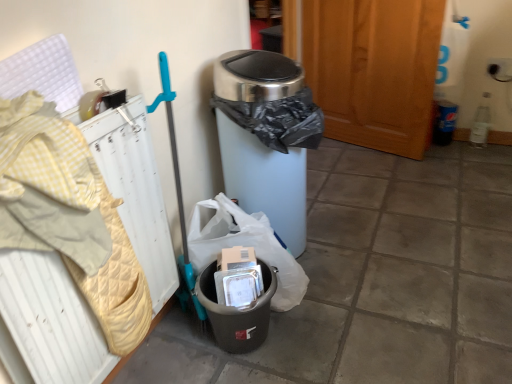
Question: From the image's perspective, does stainless steel trash can at center, the first waste container in the top-to-bottom sequence, appear higher than wooden screen door at center?

Choices:
 (A) yes
 (B) no

Answer: (B)

Question: Are stainless steel trash can at center, which is counted as the 2th waste container, starting from the bottom, and wooden screen door at center beside each other?

Choices:
 (A) yes
 (B) no

Answer: (B)

Question: From the image's perspective, is stainless steel trash can at center, the first waste container in the top-to-bottom sequence, beneath wooden screen door at center?

Choices:
 (A) yes
 (B) no

Answer: (A)

Question: Is stainless steel trash can at center, the first waste container in the top-to-bottom sequence, at the left side of wooden screen door at center?

Choices:
 (A) no
 (B) yes

Answer: (B)

Question: Can you confirm if stainless steel trash can at center, which is counted as the 2th waste container, starting from the bottom, is taller than wooden screen door at center?

Choices:
 (A) no
 (B) yes

Answer: (A)

Question: Is wooden screen door at center spatially inside matte gray trash can at lower left, which is counted as the second waste container, starting from the top, or outside of it?

Choices:
 (A) inside
 (B) outside

Answer: (B)

Question: Is wooden screen door at center wider or thinner than matte gray trash can at lower left, which is counted as the second waste container, starting from the top?

Choices:
 (A) wide
 (B) thin

Answer: (B)

Question: In the image, is wooden screen door at center positioned in front of or behind matte gray trash can at lower left, which is counted as the second waste container, starting from the top?

Choices:
 (A) behind
 (B) front

Answer: (A)

Question: From the image's perspective, is wooden screen door at center located above or below matte gray trash can at lower left, arranged as the first waste container when ordered from the bottom?

Choices:
 (A) below
 (B) above

Answer: (B)

Question: From the image's perspective, is matte gray trash can at lower left, arranged as the first waste container when ordered from the bottom, above or below yellow quilted radiator at left?

Choices:
 (A) above
 (B) below

Answer: (B)

Question: In the image, is matte gray trash can at lower left, arranged as the first waste container when ordered from the bottom, positioned in front of or behind yellow quilted radiator at left?

Choices:
 (A) front
 (B) behind

Answer: (B)

Question: Considering the positions of point (243, 327) and point (93, 352), is point (243, 327) closer or farther from the camera than point (93, 352)?

Choices:
 (A) closer
 (B) farther

Answer: (B)

Question: From a real-world perspective, is matte gray trash can at lower left, arranged as the first waste container when ordered from the bottom, above or below yellow quilted radiator at left?

Choices:
 (A) below
 (B) above

Answer: (A)

Question: Based on their positions, is stainless steel trash can at center, the first waste container in the top-to-bottom sequence, located to the left or right of yellow quilted radiator at left?

Choices:
 (A) left
 (B) right

Answer: (B)

Question: From the image's perspective, is stainless steel trash can at center, which is counted as the 2th waste container, starting from the bottom, positioned above or below yellow quilted radiator at left?

Choices:
 (A) below
 (B) above

Answer: (B)